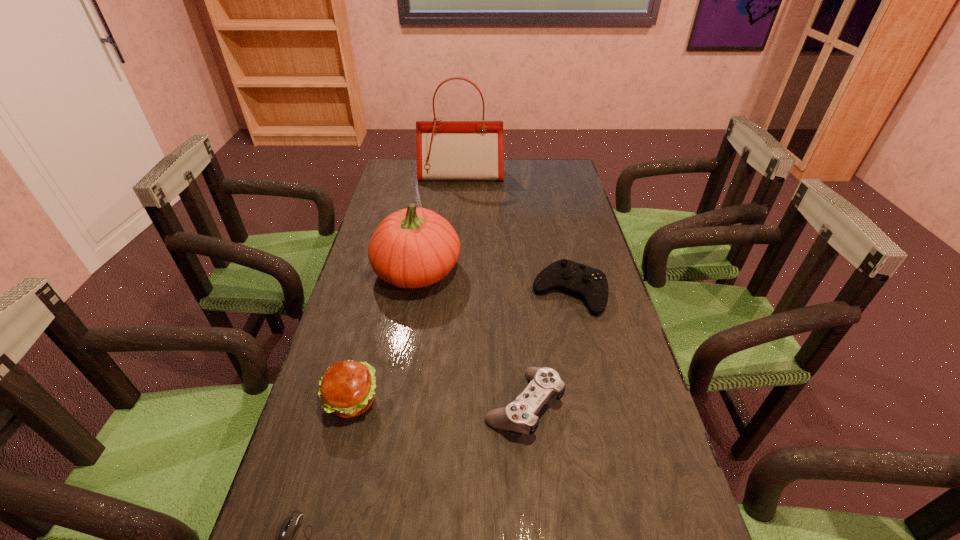
This screenshot has height=540, width=960. Identify the location of the tallest object. (446, 150).

At what (x,y) coordinates should I click in order to perform the action: click on handbag. Please return your answer as a coordinate pair (x, y). This screenshot has width=960, height=540. Looking at the image, I should click on (446, 150).

The height and width of the screenshot is (540, 960). Identify the location of pumpkin. (414, 247).

Find the location of a particular element. The image size is (960, 540). hamburger is located at coordinates (347, 388).

Identify the location of the farther control. The image size is (960, 540). (591, 284).

You are a GUI agent. You are given a task and a screenshot of the screen. Output one action in this format:
    pyautogui.click(x=<x>, y=<y>)
    Task: Click on the nearer control
    The height and width of the screenshot is (540, 960).
    Given the screenshot: What is the action you would take?
    pyautogui.click(x=520, y=415)

Identify the location of vacant space located on the right of the handbag. (558, 176).

Locate an element on the screen. The height and width of the screenshot is (540, 960). free region located on the front of the pumpkin is located at coordinates (408, 329).

Locate an element on the screen. vacant space located on the right of the hamburger is located at coordinates (535, 401).

What are the coordinates of `free region located on the back of the farther control` in the screenshot? It's located at (556, 237).